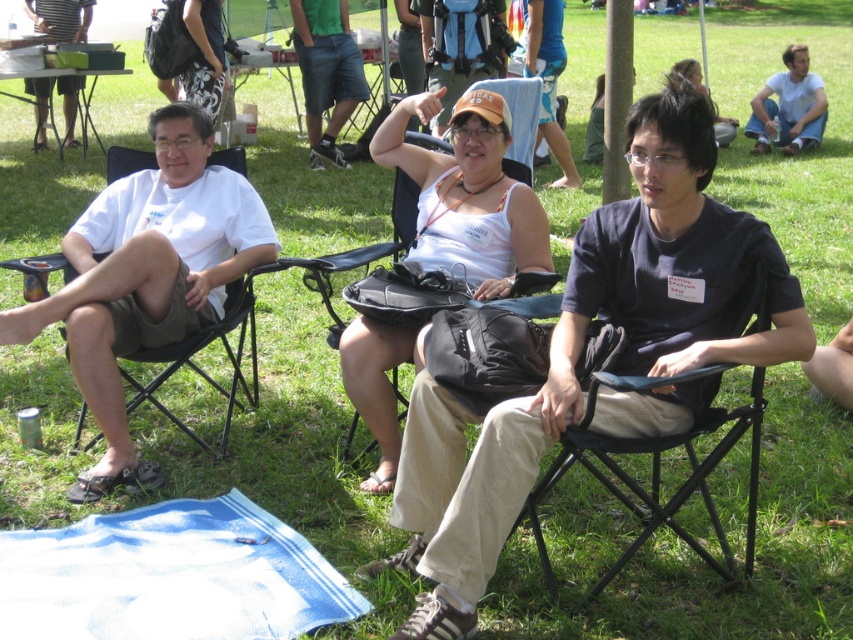
Question: Does white cotton shirt at left have a greater width compared to white cotton shirt at upper right?

Choices:
 (A) yes
 (B) no

Answer: (B)

Question: Can you confirm if dark blue t-shirt at center is positioned below white cotton shirt at left?

Choices:
 (A) yes
 (B) no

Answer: (A)

Question: Is white cotton shirt at left above white cotton shirt at upper right?

Choices:
 (A) no
 (B) yes

Answer: (A)

Question: Which point is farther from the camera taking this photo?

Choices:
 (A) coord(491,534)
 (B) coord(142,176)
 (C) coord(753,401)
 (D) coord(775,113)

Answer: (D)

Question: Among these points, which one is farthest from the camera?

Choices:
 (A) (102, 349)
 (B) (799, 100)
 (C) (350, 333)

Answer: (B)

Question: Considering the real-world distances, which object is closest to the white fabric tank top at center?

Choices:
 (A) dark blue t-shirt at center
 (B) white cotton shirt at upper right
 (C) white cotton shirt at left
 (D) black fabric chair at center

Answer: (A)